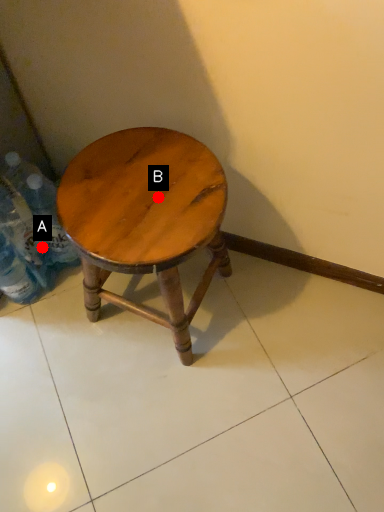
Question: Two points are circled on the image, labeled by A and B beside each circle. Which point is farther from the camera taking this photo?

Choices:
 (A) A is further
 (B) B is further

Answer: (A)